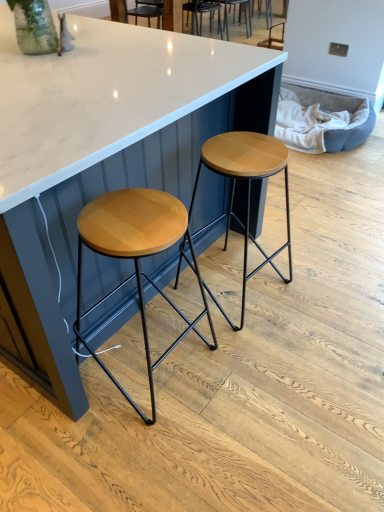
Question: Considering the relative positions of white glossy table at center and woodenmaterial/texturestool at left, which appears as the 2th stool when viewed from the right, in the image provided, is white glossy table at center to the left of woodenmaterial/texturestool at left, which appears as the 2th stool when viewed from the right, from the viewer's perspective?

Choices:
 (A) no
 (B) yes

Answer: (B)

Question: Is white glossy table at center not inside woodenmaterial/texturestool at left, arranged as the first stool when viewed from the left?

Choices:
 (A) yes
 (B) no

Answer: (A)

Question: Is woodenmaterial/texturestool at left, which appears as the 2th stool when viewed from the right, a part of white glossy table at center?

Choices:
 (A) no
 (B) yes

Answer: (B)

Question: From the image's perspective, does white glossy table at center appear higher than woodenmaterial/texturestool at left, which appears as the 2th stool when viewed from the right?

Choices:
 (A) yes
 (B) no

Answer: (A)

Question: Does white glossy table at center have a greater height compared to woodenmaterial/texturestool at left, which appears as the 2th stool when viewed from the right?

Choices:
 (A) no
 (B) yes

Answer: (B)

Question: From a real-world perspective, is woodenmaterial/texturestool at left, arranged as the first stool when viewed from the left, positioned above or below white glossy table at center?

Choices:
 (A) above
 (B) below

Answer: (B)

Question: From the image's perspective, is woodenmaterial/texturestool at left, which appears as the 2th stool when viewed from the right, above or below white glossy table at center?

Choices:
 (A) below
 (B) above

Answer: (A)

Question: Is woodenmaterial/texturestool at left, which appears as the 2th stool when viewed from the right, spatially inside white glossy table at center, or outside of it?

Choices:
 (A) outside
 (B) inside

Answer: (B)

Question: Does point (148, 372) appear closer or farther from the camera than point (162, 31)?

Choices:
 (A) closer
 (B) farther

Answer: (A)

Question: In terms of height, does wooden matte stool at center, the first stool viewed from the right, look taller or shorter compared to woodenmaterial/texturestool at left, arranged as the first stool when viewed from the left?

Choices:
 (A) tall
 (B) short

Answer: (B)

Question: From a real-world perspective, is wooden matte stool at center, the first stool viewed from the right, positioned above or below woodenmaterial/texturestool at left, arranged as the first stool when viewed from the left?

Choices:
 (A) above
 (B) below

Answer: (A)

Question: Is wooden matte stool at center, the first stool viewed from the right, situated inside woodenmaterial/texturestool at left, arranged as the first stool when viewed from the left, or outside?

Choices:
 (A) outside
 (B) inside

Answer: (A)

Question: From the image's perspective, is wooden matte stool at center, which is the 2th stool in left-to-right order, located above or below woodenmaterial/texturestool at left, which appears as the 2th stool when viewed from the right?

Choices:
 (A) above
 (B) below

Answer: (A)

Question: Considering the positions of wooden seat at center, the second chair positioned from the back, and wooden matte stool at center, which is the 2th stool in left-to-right order, in the image, is wooden seat at center, the second chair positioned from the back, wider or thinner than wooden matte stool at center, which is the 2th stool in left-to-right order,?

Choices:
 (A) wide
 (B) thin

Answer: (A)

Question: From the image's perspective, is wooden seat at center, the first chair viewed from the front, above or below wooden matte stool at center, the first stool viewed from the right?

Choices:
 (A) above
 (B) below

Answer: (A)